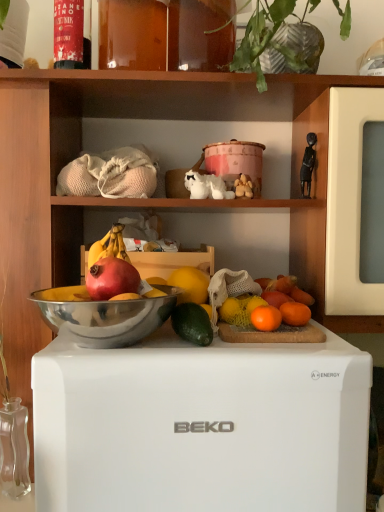
The width and height of the screenshot is (384, 512). What are the coordinates of `free location to the right of orange matte grapefruit at upper right, which ranks as the second grapefruit in left-to-right order` in the screenshot? It's located at (314, 334).